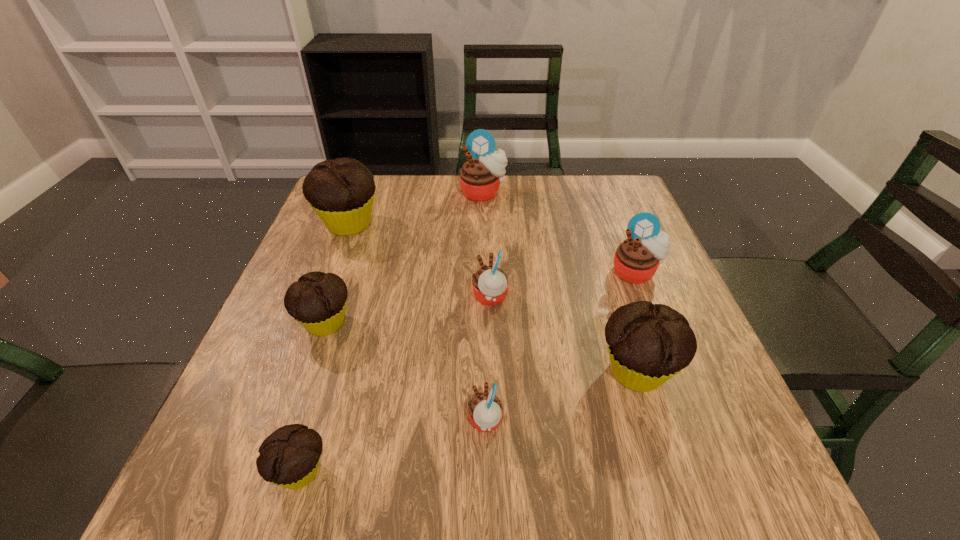
Where is `vacant region between the farthest chocolate muffin and the farthest object`? This screenshot has width=960, height=540. vacant region between the farthest chocolate muffin and the farthest object is located at coordinates (416, 208).

The width and height of the screenshot is (960, 540). In order to click on free space between the second biggest pink muffin and the seventh nearest muffin in this screenshot , I will do `click(492, 248)`.

The height and width of the screenshot is (540, 960). I want to click on empty space that is in between the farthest chocolate muffin and the second biggest pink muffin, so tap(492, 248).

The width and height of the screenshot is (960, 540). What are the coordinates of `empty space between the second biggest chocolate muffin and the nearest pink muffin` in the screenshot? It's located at (562, 396).

You are a GUI agent. You are given a task and a screenshot of the screen. Output one action in this format:
    pyautogui.click(x=<x>, y=<y>)
    Task: Click on the vacant area that lies between the second biggest pink muffin and the smallest pink muffin
    The width and height of the screenshot is (960, 540).
    Given the screenshot: What is the action you would take?
    pyautogui.click(x=561, y=347)

Where is `unoccupied position between the second farthest object and the second biggest pink muffin`? The image size is (960, 540). unoccupied position between the second farthest object and the second biggest pink muffin is located at coordinates (492, 248).

In order to click on vacant area that lies between the second smallest chocolate muffin and the smallest chocolate muffin in this screenshot , I will do `click(313, 397)`.

I want to click on object that is the sixth closest to the smallest pink muffin, so click(341, 191).

Choose which object is the second nearest neighbor to the rightmost pink muffin. Please provide its 2D coordinates. Your answer should be formatted as a tuple, i.e. [(x, y)], where the tuple contains the x and y coordinates of a point satisfying the conditions above.

[(490, 284)]

You are a GUI agent. You are given a task and a screenshot of the screen. Output one action in this format:
    pyautogui.click(x=<x>, y=<y>)
    Task: Click on the muffin that stands as the sixth closest to the second biggest chocolate muffin
    This screenshot has width=960, height=540.
    Given the screenshot: What is the action you would take?
    pyautogui.click(x=480, y=177)